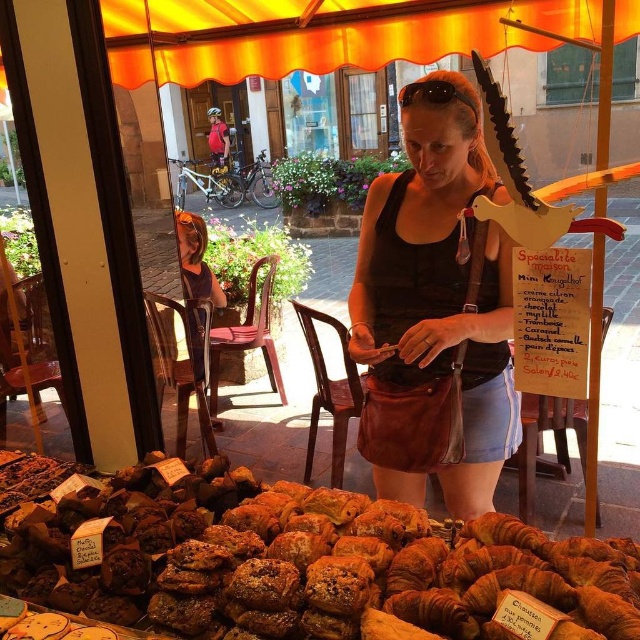
Question: Considering the real-world distances, which object is closest to the golden brown croissant at center?

Choices:
 (A) matte black tank top at center
 (B) orange fabric chair at lower left

Answer: (A)

Question: Can you confirm if golden brown croissant at center is positioned to the left of orange fabric chair at lower left?

Choices:
 (A) yes
 (B) no

Answer: (B)

Question: Which is nearer to the orange fabric chair at lower left?

Choices:
 (A) golden brown croissant at center
 (B) matte black tank top at center

Answer: (B)

Question: Which object appears closest to the camera in this image?

Choices:
 (A) orange fabric chair at lower left
 (B) golden brown croissant at center
 (C) matte black tank top at center

Answer: (B)

Question: Can you confirm if golden brown croissant at center is wider than matte black tank top at center?

Choices:
 (A) yes
 (B) no

Answer: (A)

Question: Can you confirm if golden brown croissant at center is positioned above orange fabric chair at lower left?

Choices:
 (A) no
 (B) yes

Answer: (A)